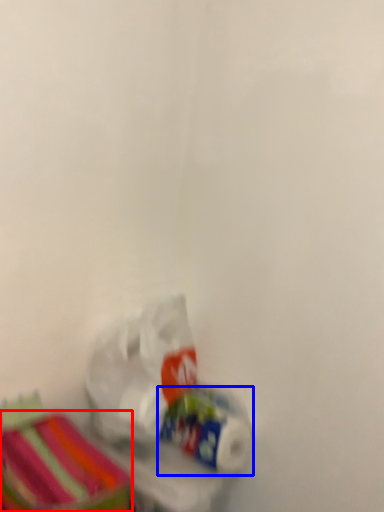
Question: Which object is closer to the camera taking this photo, storage box (highlighted by a red box) or toilet paper (highlighted by a blue box)?

Choices:
 (A) storage box
 (B) toilet paper

Answer: (A)